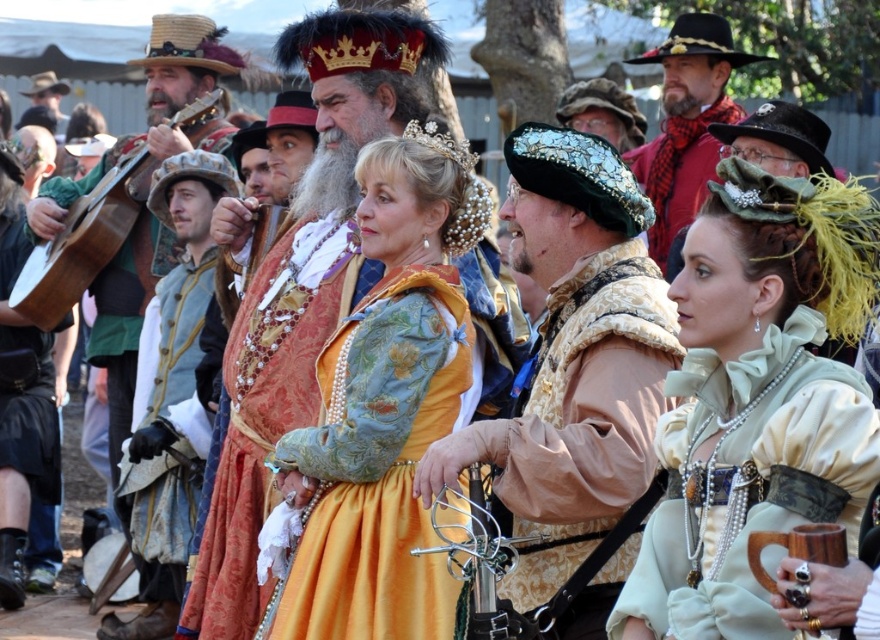
Question: Is matte gold dress at center closer to camera compared to matte red scarf at center?

Choices:
 (A) no
 (B) yes

Answer: (B)

Question: Is matte cream fabric dress at center bigger than shiny silver helmet at center?

Choices:
 (A) no
 (B) yes

Answer: (B)

Question: Among these objects, which one is farthest from the camera?

Choices:
 (A) matte cream fabric dress at center
 (B) gold brocade dress at center
 (C) matte brown leather hat at upper left
 (D) matte red scarf at center

Answer: (C)

Question: Which point appears farthest from the camera in this image?

Choices:
 (A) (832, 262)
 (B) (259, 419)
 (C) (572, 88)
 (D) (59, 209)

Answer: (C)

Question: Which object is closer to the camera taking this photo?

Choices:
 (A) matte gold dress at center
 (B) wooden acoustic guitar at left
 (C) light blue fabric coat at left

Answer: (A)

Question: In this image, where is wooden acoustic guitar at left located relative to matte brown leather hat at upper left?

Choices:
 (A) left
 (B) right

Answer: (B)